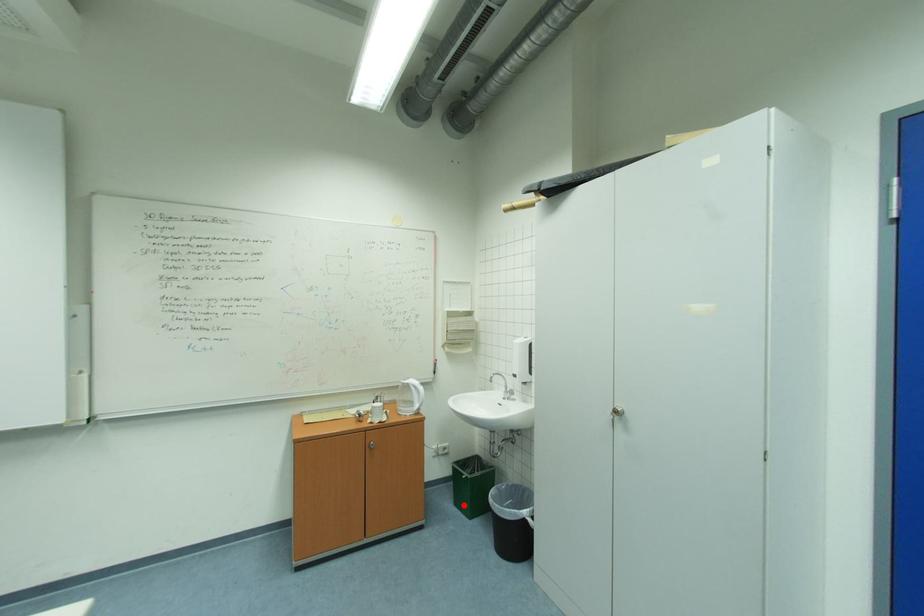
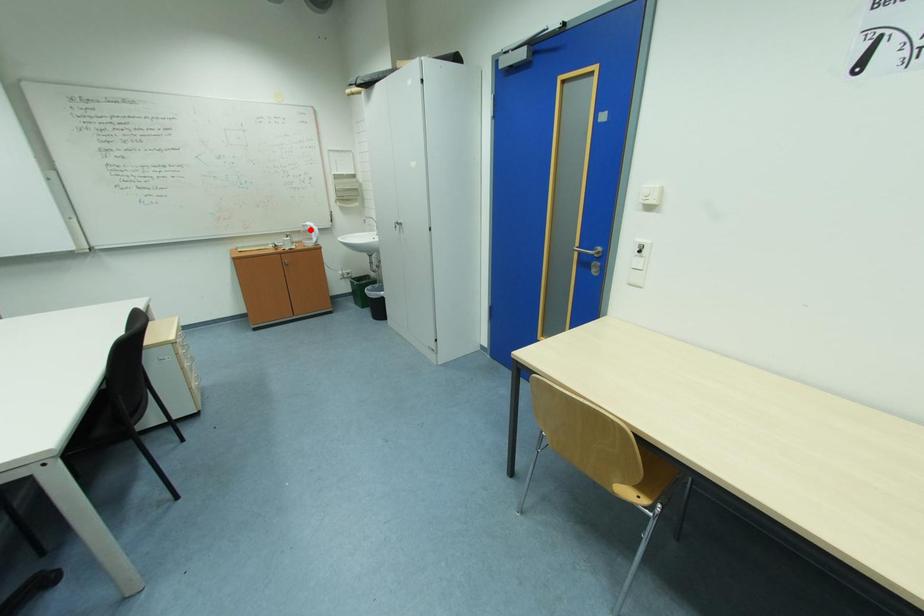
I am providing you with two images of the same scene from different viewpoints. A red point is marked on the first image and another point is marked on the second image. Does the point marked in image1 correspond to the same location as the one in image2?

No